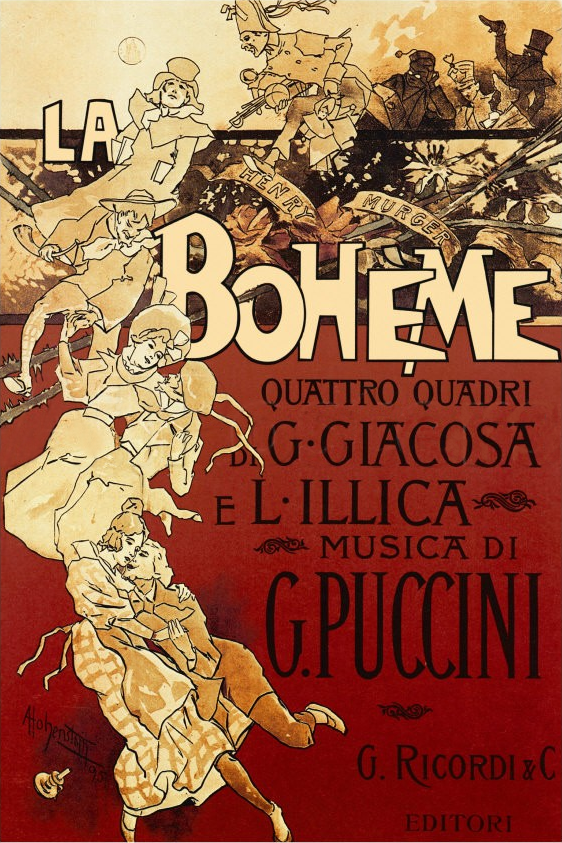
Locate an element on the screen. This screenshot has height=843, width=562. book is located at coordinates (542, 545).